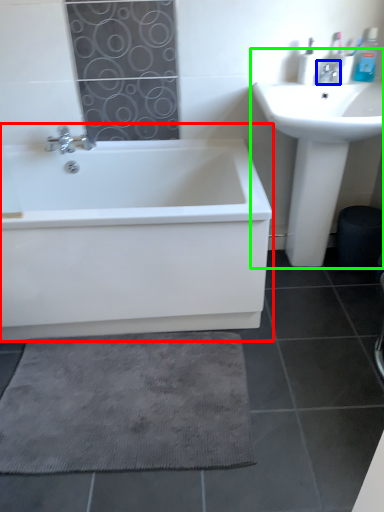
Question: Which object is positioned farthest from bathtub (highlighted by a red box)? Select from tap (highlighted by a blue box) and sink (highlighted by a green box).

Choices:
 (A) tap
 (B) sink

Answer: (A)